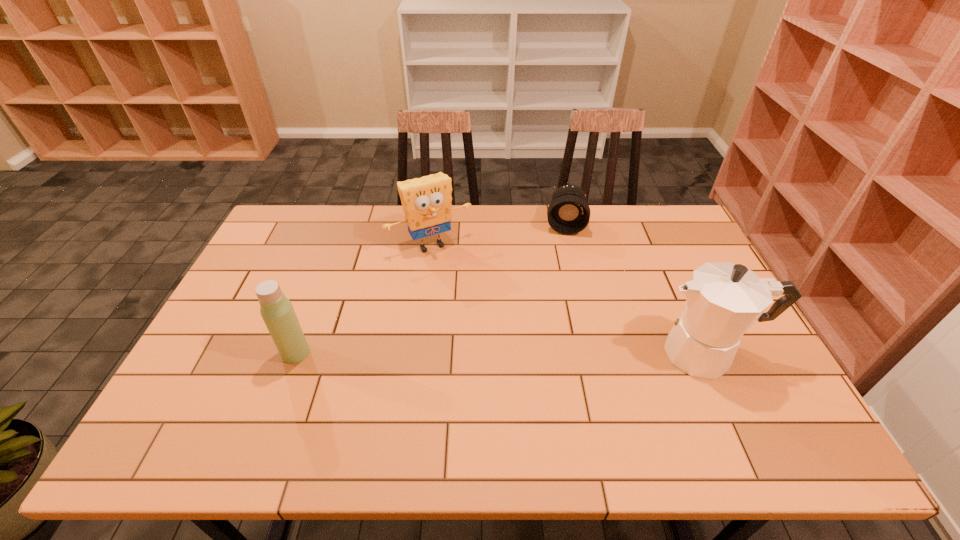
Locate an element on the screen. The image size is (960, 540). vacant space on the desktop that is between the thermos bottle and the tallest object and is positioned on the face of the second object from left to right is located at coordinates (497, 353).

Locate an element on the screen. vacant space on the desktop that is between the thermos bottle and the coffeepot and is positioned at the front element of the shortest object is located at coordinates (561, 353).